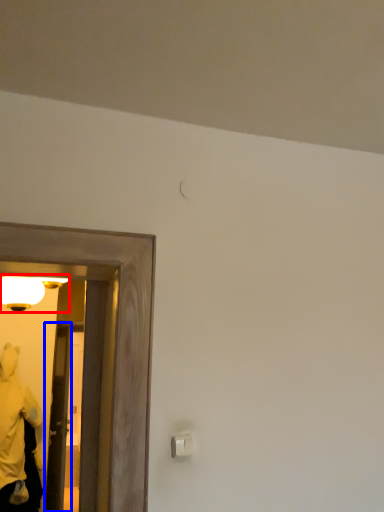
Question: Which object is further to the camera taking this photo, light fixture (highlighted by a red box) or door (highlighted by a blue box)?

Choices:
 (A) light fixture
 (B) door

Answer: (B)